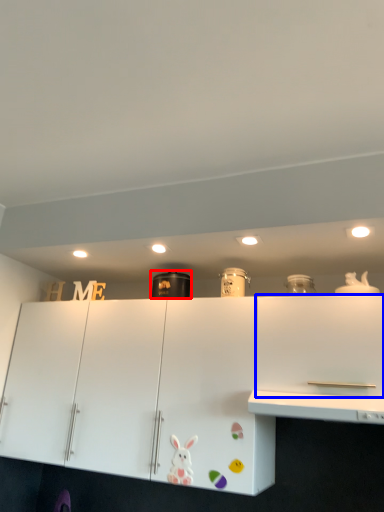
Question: Which object is further to the camera taking this photo, appliance (highlighted by a red box) or cabinetry (highlighted by a blue box)?

Choices:
 (A) appliance
 (B) cabinetry

Answer: (A)